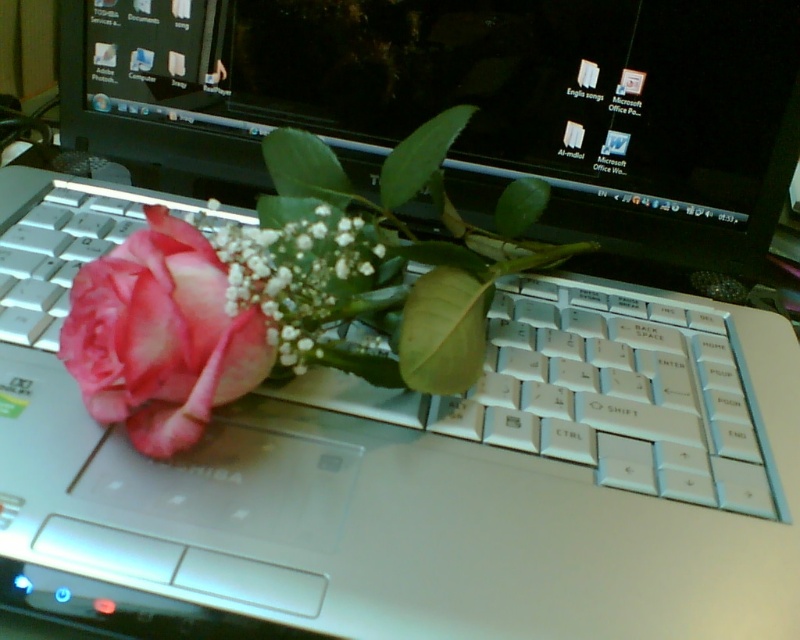
Which is below, pink matte rose at center or matte pink rose at left?

Positioned lower is matte pink rose at left.

Is point (344, 80) farther from viewer compared to point (237, 381)?

Yes, it is behind point (237, 381).

Locate an element on the screen. pink matte rose at center is located at coordinates (464, 102).

Can you confirm if pink matte rose at center is shorter than pink matte flower at center?

In fact, pink matte rose at center may be taller than pink matte flower at center.

Who is positioned more to the right, pink matte rose at center or pink matte flower at center?

pink matte rose at center is more to the right.

The image size is (800, 640). What do you see at coordinates (464, 102) in the screenshot? I see `pink matte rose at center` at bounding box center [464, 102].

Locate an element on the screen. This screenshot has width=800, height=640. pink matte rose at center is located at coordinates (464, 102).

Can you confirm if matte pink rose at left is positioned below pink matte flower at center?

Indeed, matte pink rose at left is positioned under pink matte flower at center.

Between matte pink rose at left and pink matte flower at center, which one is positioned lower?

matte pink rose at left is below.

Is point (164, 403) in front of point (210, 236)?

Yes, point (164, 403) is in front of point (210, 236).

Where is `matte pink rose at left`? matte pink rose at left is located at coordinates (160, 337).